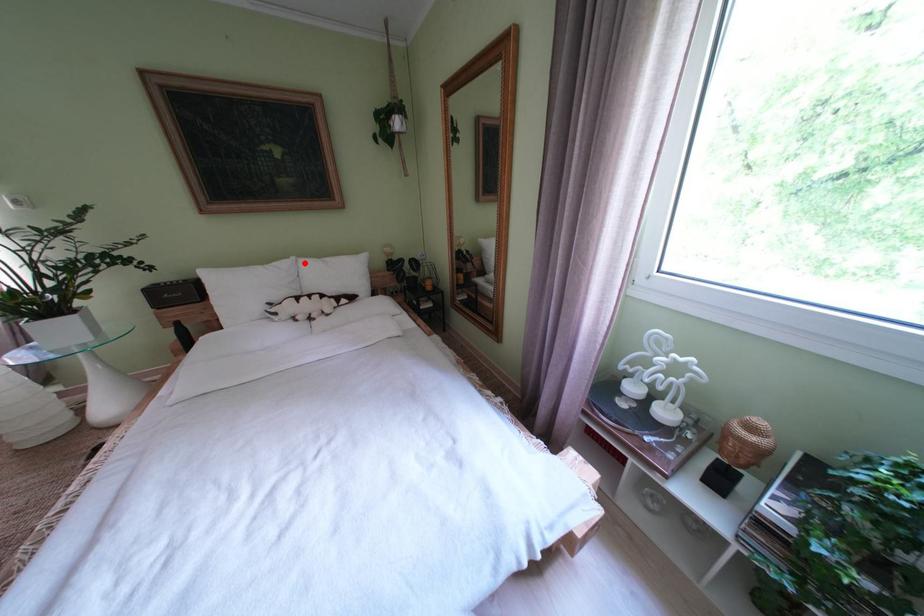
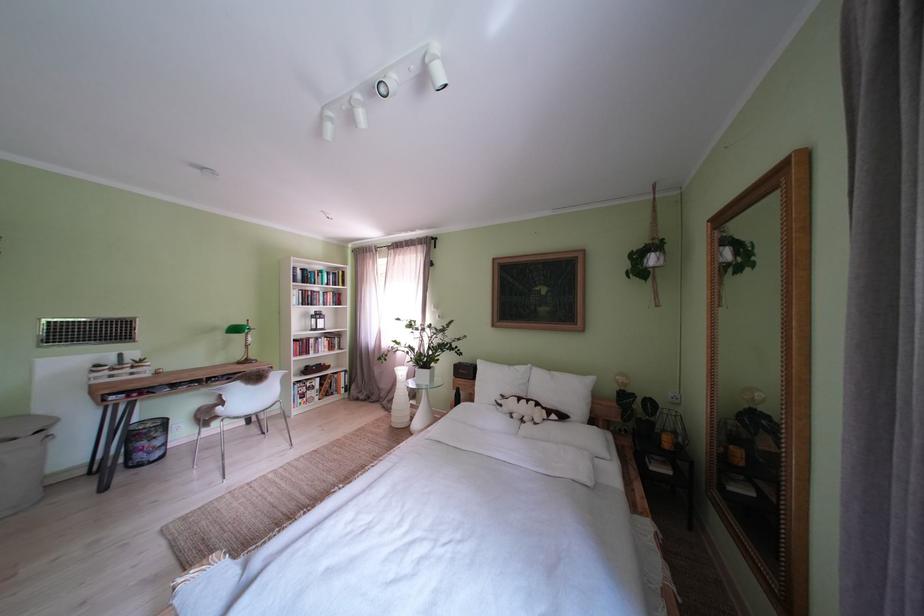
Question: A red point is marked in image1. In image2, is the corresponding 3D point closer to the camera or farther? Reply with the corresponding letter.

Choices:
 (A) The corresponding 3D point is closer.
 (B) The corresponding 3D point is farther.

Answer: (B)